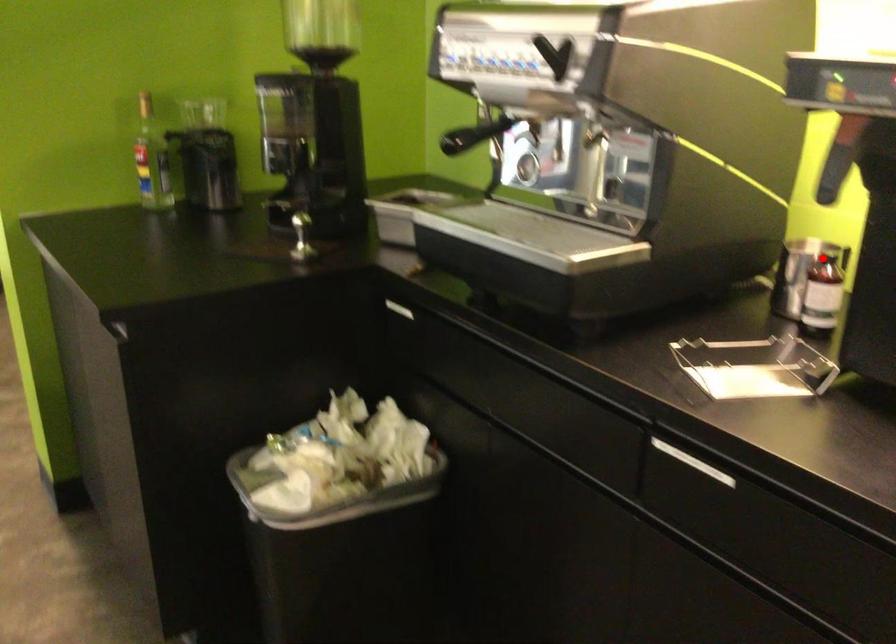
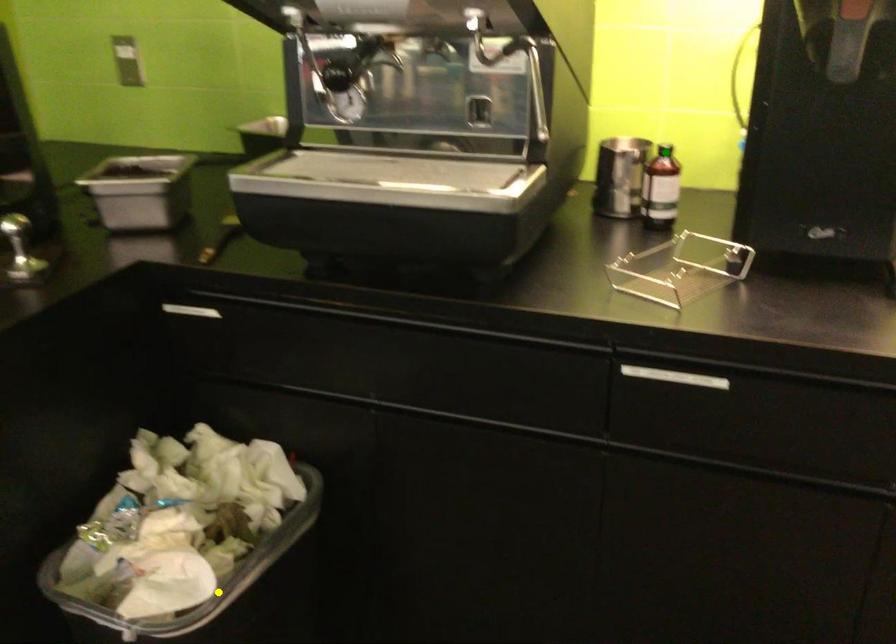
Question: I am providing you with two images of the same scene from different viewpoints. A red point is marked on the first image. You are given multiple points on the second image. Which point in image 2 represents the same 3d spot as the red point in image 1?

Choices:
 (A) green point
 (B) blue point
 (C) yellow point

Answer: (A)